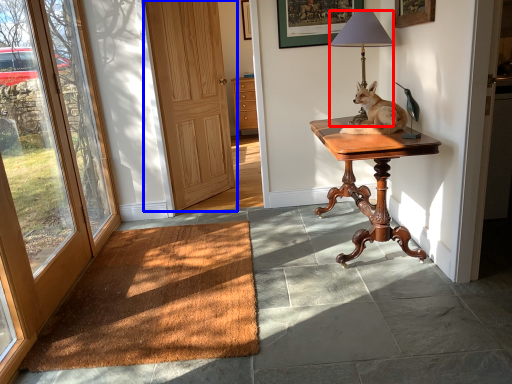
Question: Which point is closer to the camera, lamp (highlighted by a red box) or door (highlighted by a blue box)?

Choices:
 (A) lamp
 (B) door

Answer: (A)